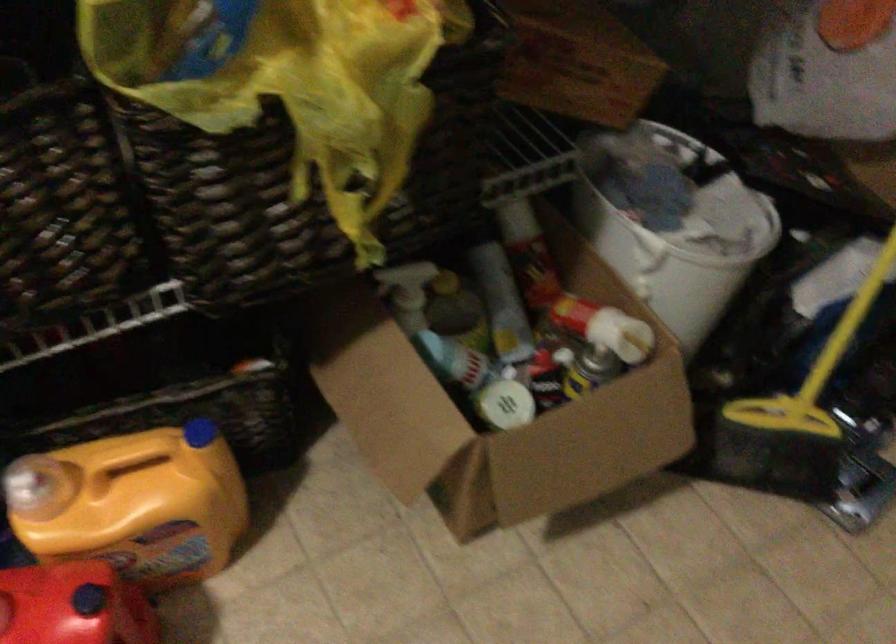
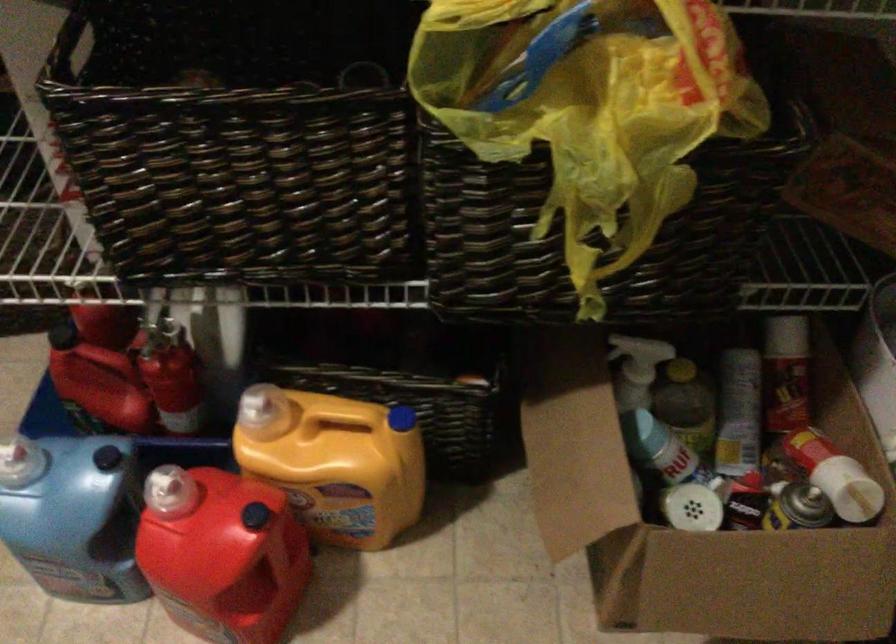
Question: The images are taken continuously from a first-person perspective. In which direction are you moving?

Choices:
 (A) Left
 (B) Right
 (C) Forward
 (D) Backward

Answer: (B)